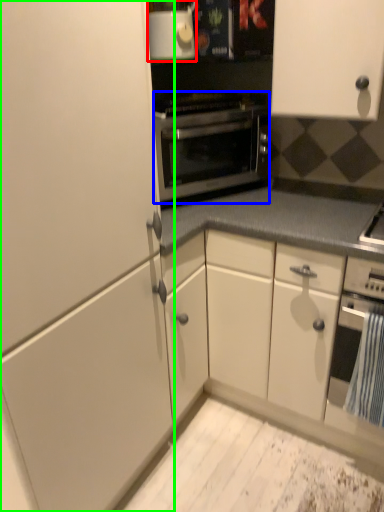
Question: Based on their relative distances, which object is farther from appliance (highlighted by a red box)? Choose from oven (highlighted by a blue box) and cabinetry (highlighted by a green box).

Choices:
 (A) oven
 (B) cabinetry

Answer: (B)